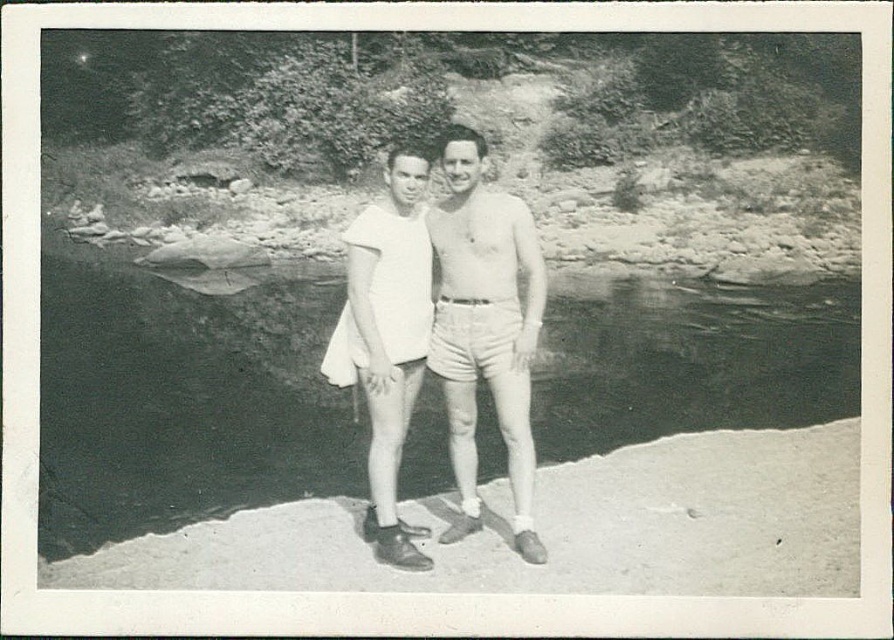
You are a GUI agent. You are given a task and a screenshot of the screen. Output one action in this format:
    pyautogui.click(x=<x>, y=<y>)
    Task: Click on the black water at center
    
    Given the screenshot: What is the action you would take?
    pyautogui.click(x=182, y=403)

Is black water at center positioned behind white cotton shirt at center?

Yes, it is.

Find the location of `black water at center`. black water at center is located at coordinates (182, 403).

You are a GUI agent. You are given a task and a screenshot of the screen. Output one action in this format:
    pyautogui.click(x=<x>, y=<y>)
    Task: Click on the black water at center
    
    Given the screenshot: What is the action you would take?
    pyautogui.click(x=182, y=403)